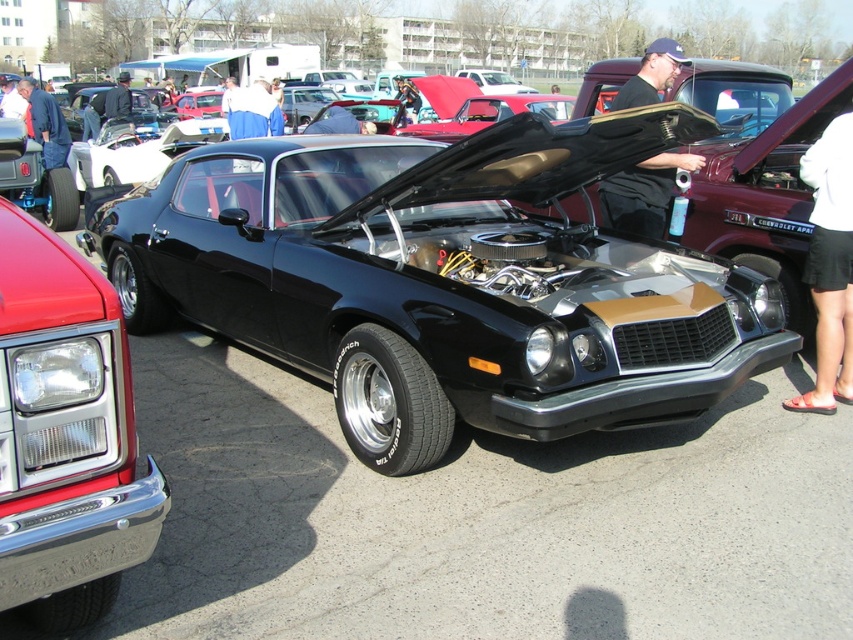
From the picture: You are a photographer at the car show and want to position a spotlight exactly at the center of the image. The black fabric shirt at upper center is in the way. Where should you place the spotlight to avoid it?

The black fabric shirt at upper center is located at point (x=643, y=193). To avoid it, place the spotlight away from that coordinate, such as at the center point of the image, which is typically at (x=426, y=320).